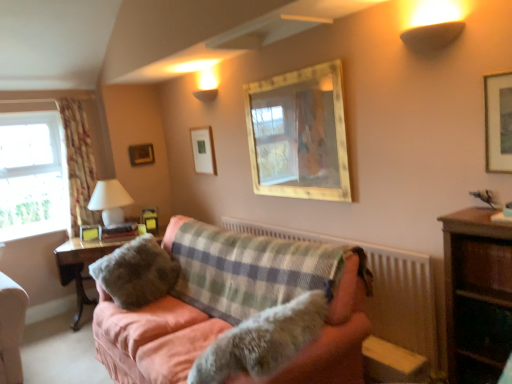
Locate an element on the screen. The height and width of the screenshot is (384, 512). free point above floral fabric curtain at left (from a real-world perspective) is located at coordinates (67, 98).